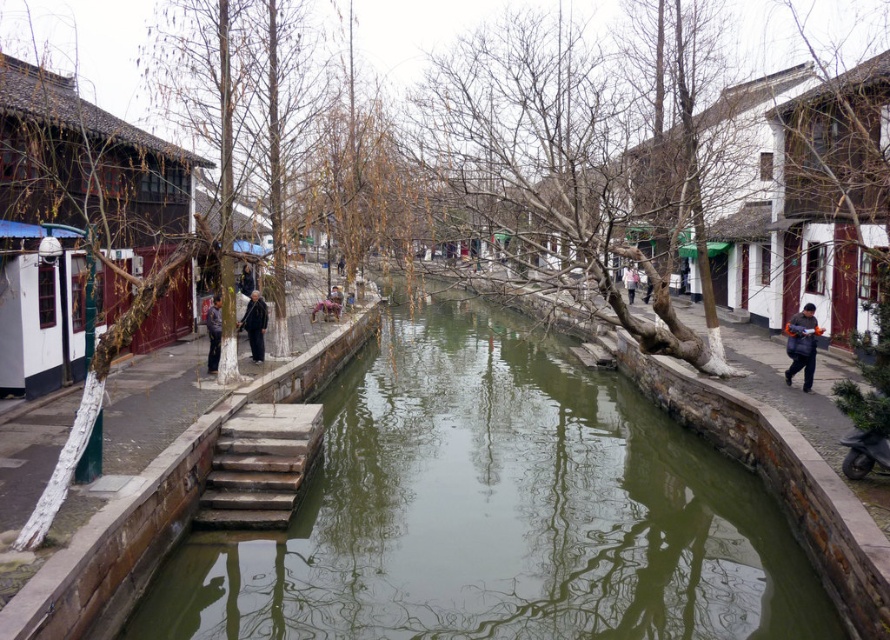
Question: Which point is closer to the camera?

Choices:
 (A) light brown leather jacket at center
 (B) orange fuzzy jacket at right

Answer: (A)

Question: Is green stone river at center behind wooden stairs at center?

Choices:
 (A) yes
 (B) no

Answer: (B)

Question: Is green stone river at center bigger than dark gray fabric jacket at left?

Choices:
 (A) yes
 (B) no

Answer: (A)

Question: In this image, where is green stone river at center located relative to black matte jacket at left?

Choices:
 (A) right
 (B) left

Answer: (A)

Question: Considering the real-world distances, which object is closest to the dark gray fabric jacket at left?

Choices:
 (A) orange fuzzy jacket at right
 (B) black matte jacket at left
 (C) dark blue jacket at left

Answer: (B)

Question: Which object appears closest to the camera in this image?

Choices:
 (A) dark blue jacket at left
 (B) light brown leather jacket at center

Answer: (A)